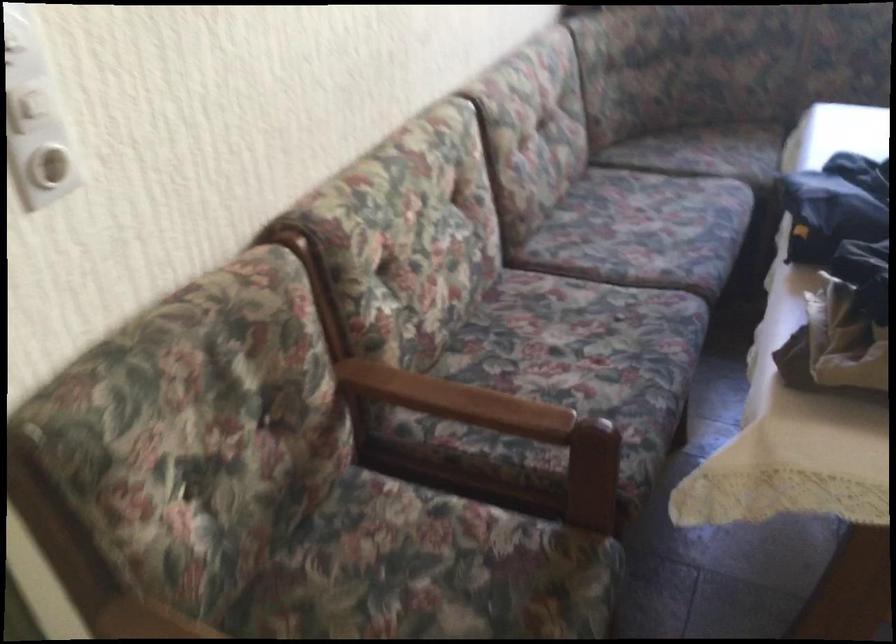
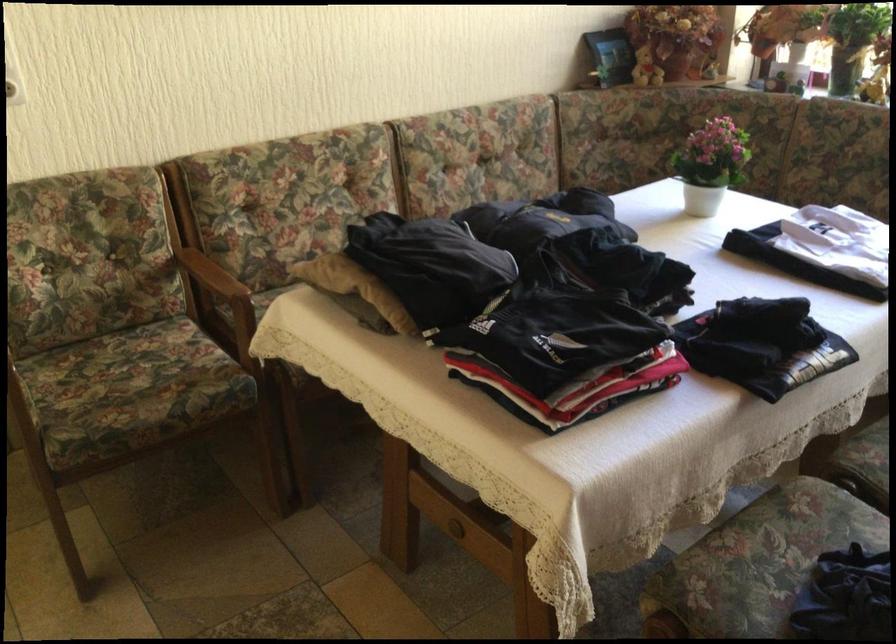
Where in the second image is the point corresponding to the point at 424,386 from the first image?

(204, 269)